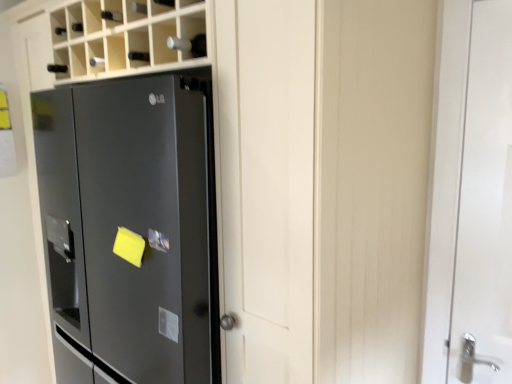
Question: From a real-world perspective, relative to satin black refrigerator at left, is white glossy door at right vertically above or below?

Choices:
 (A) above
 (B) below

Answer: (A)

Question: Would you say white glossy door at right is inside or outside satin black refrigerator at left?

Choices:
 (A) inside
 (B) outside

Answer: (B)

Question: Is white glossy door at right wider or thinner than satin black refrigerator at left?

Choices:
 (A) thin
 (B) wide

Answer: (A)

Question: Looking at their shapes, would you say satin black refrigerator at left is wider or thinner than white glossy door at right?

Choices:
 (A) wide
 (B) thin

Answer: (A)

Question: Is point (169, 342) positioned closer to the camera than point (495, 170)?

Choices:
 (A) closer
 (B) farther

Answer: (A)

Question: Is satin black refrigerator at left spatially inside white glossy door at right, or outside of it?

Choices:
 (A) outside
 (B) inside

Answer: (A)

Question: Considering the positions of satin black refrigerator at left and white glossy door at right in the image, is satin black refrigerator at left taller or shorter than white glossy door at right?

Choices:
 (A) tall
 (B) short

Answer: (A)